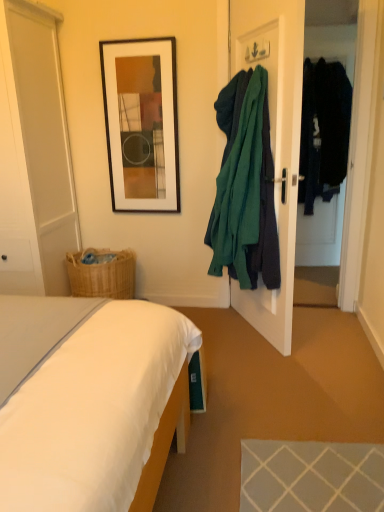
Question: Is white glossy door at left, the 2th glass door in the right-to-left sequence, further to the viewer compared to teal fabric coat at right, positioned as the first clothing in front-to-back order?

Choices:
 (A) yes
 (B) no

Answer: (A)

Question: Is teal fabric coat at right, the first clothing positioned from the left, at the back of white glossy door at left, the 2th glass door in the right-to-left sequence?

Choices:
 (A) no
 (B) yes

Answer: (A)

Question: Does white glossy door at left, the 2th glass door in the right-to-left sequence, touch teal fabric coat at right, acting as the 2th clothing starting from the back?

Choices:
 (A) yes
 (B) no

Answer: (B)

Question: From a real-world perspective, is white glossy door at left, the 2th glass door in the right-to-left sequence, located beneath teal fabric coat at right, the 2th clothing when ordered from right to left?

Choices:
 (A) yes
 (B) no

Answer: (B)

Question: Could you tell me if white glossy door at left, the 2th glass door in the right-to-left sequence, is turned towards teal fabric coat at right, the 2th clothing when ordered from right to left?

Choices:
 (A) no
 (B) yes

Answer: (A)

Question: Would you say transparent glass door at right, positioned as the 2th glass door in left-to-right order, is to the left or to the right of teal fabric coat at right, the first clothing positioned from the left, in the picture?

Choices:
 (A) left
 (B) right

Answer: (B)

Question: Looking at the image, does transparent glass door at right, marked as the 1th glass door in a right-to-left arrangement, seem bigger or smaller compared to teal fabric coat at right, the first clothing positioned from the left?

Choices:
 (A) big
 (B) small

Answer: (B)

Question: Considering the positions of transparent glass door at right, marked as the 1th glass door in a right-to-left arrangement, and teal fabric coat at right, positioned as the first clothing in front-to-back order, in the image, is transparent glass door at right, marked as the 1th glass door in a right-to-left arrangement, taller or shorter than teal fabric coat at right, positioned as the first clothing in front-to-back order,?

Choices:
 (A) short
 (B) tall

Answer: (B)

Question: From the image's perspective, is transparent glass door at right, marked as the 1th glass door in a right-to-left arrangement, positioned above or below teal fabric coat at right, the first clothing positioned from the left?

Choices:
 (A) below
 (B) above

Answer: (B)

Question: In terms of size, does white glossy door at left, placed as the first glass door when sorted from left to right, appear bigger or smaller than teal fabric coat at right, the 2th clothing when ordered from right to left?

Choices:
 (A) big
 (B) small

Answer: (A)

Question: In terms of height, does white glossy door at left, the 2th glass door in the right-to-left sequence, look taller or shorter compared to teal fabric coat at right, the first clothing positioned from the left?

Choices:
 (A) tall
 (B) short

Answer: (A)

Question: Is point (0, 176) positioned closer to the camera than point (241, 87)?

Choices:
 (A) farther
 (B) closer

Answer: (A)

Question: Visually, is white glossy door at left, placed as the first glass door when sorted from left to right, positioned to the left or to the right of teal fabric coat at right, the first clothing positioned from the left?

Choices:
 (A) left
 (B) right

Answer: (A)

Question: In the image, is teal fabric coat at right, acting as the 2th clothing starting from the back, on the left side or the right side of black matte picture frame at upper center?

Choices:
 (A) right
 (B) left

Answer: (A)

Question: Is point (276, 269) closer or farther from the camera than point (137, 52)?

Choices:
 (A) closer
 (B) farther

Answer: (A)